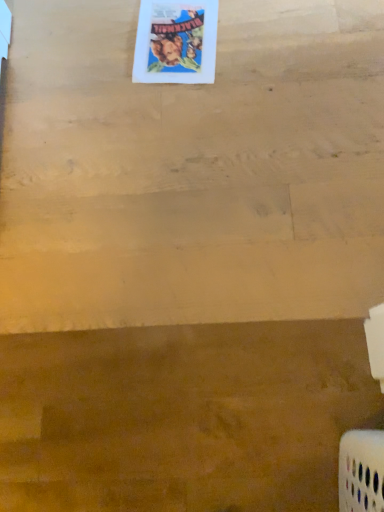
What is the approximate width of matte paper comic book at upper center?

The width of matte paper comic book at upper center is 12.27 inches.

What is the approximate height of matte paper comic book at upper center?

It is 0.43 inches.

Describe the element at coordinates (176, 42) in the screenshot. I see `matte paper comic book at upper center` at that location.

Identify the location of matte paper comic book at upper center. This screenshot has height=512, width=384. pyautogui.click(x=176, y=42).

Image resolution: width=384 pixels, height=512 pixels. Identify the location of matte paper comic book at upper center. (176, 42).